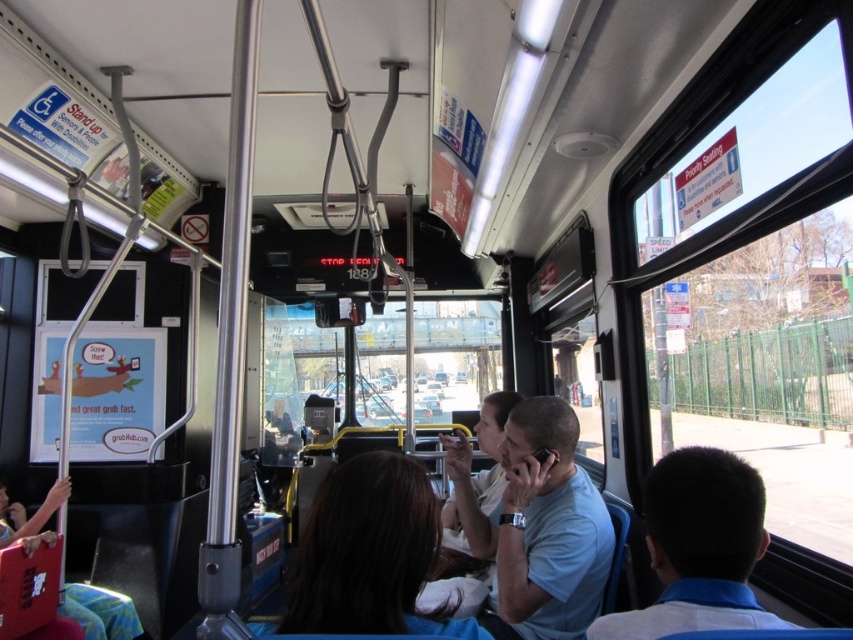
You are a passenger on the bus and want to check your reflection in the nearest mirror. The brown hair at center and dark blue shirt at right are in your line of sight. Which object is closer to the mirror?

The brown hair at center is closer to the mirror since it is positioned over the dark blue shirt at right, indicating it is in front of the shirt and thus nearer to the mirror.